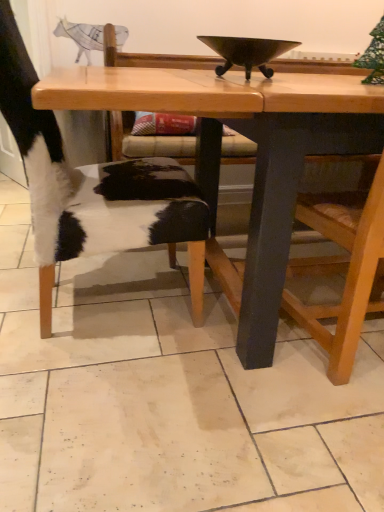
Question: Is wooden chair at right not inside cowhide leather chair at left?

Choices:
 (A) no
 (B) yes

Answer: (B)

Question: Considering the relative sizes of wooden chair at right and cowhide leather chair at left in the image provided, is wooden chair at right shorter than cowhide leather chair at left?

Choices:
 (A) yes
 (B) no

Answer: (A)

Question: From the image's perspective, is wooden chair at right under cowhide leather chair at left?

Choices:
 (A) yes
 (B) no

Answer: (A)

Question: Does wooden chair at right have a larger size compared to cowhide leather chair at left?

Choices:
 (A) no
 (B) yes

Answer: (A)

Question: From the image's perspective, is wooden chair at right above cowhide leather chair at left?

Choices:
 (A) yes
 (B) no

Answer: (B)

Question: Is wooden chair at right facing towards cowhide leather chair at left?

Choices:
 (A) yes
 (B) no

Answer: (B)

Question: Can you confirm if shiny dark metal bowl at center is wider than wooden chair at right?

Choices:
 (A) yes
 (B) no

Answer: (B)

Question: Is shiny dark metal bowl at center far away from wooden chair at right?

Choices:
 (A) no
 (B) yes

Answer: (A)

Question: Is shiny dark metal bowl at center closer to camera compared to wooden chair at right?

Choices:
 (A) no
 (B) yes

Answer: (A)

Question: Is shiny dark metal bowl at center positioned beyond the bounds of wooden chair at right?

Choices:
 (A) no
 (B) yes

Answer: (B)

Question: Can you confirm if shiny dark metal bowl at center is thinner than wooden chair at right?

Choices:
 (A) yes
 (B) no

Answer: (A)

Question: From the image's perspective, is shiny dark metal bowl at center located beneath wooden chair at right?

Choices:
 (A) no
 (B) yes

Answer: (A)

Question: Can you confirm if shiny dark metal bowl at center is positioned to the left of wooden table at center?

Choices:
 (A) no
 (B) yes

Answer: (B)